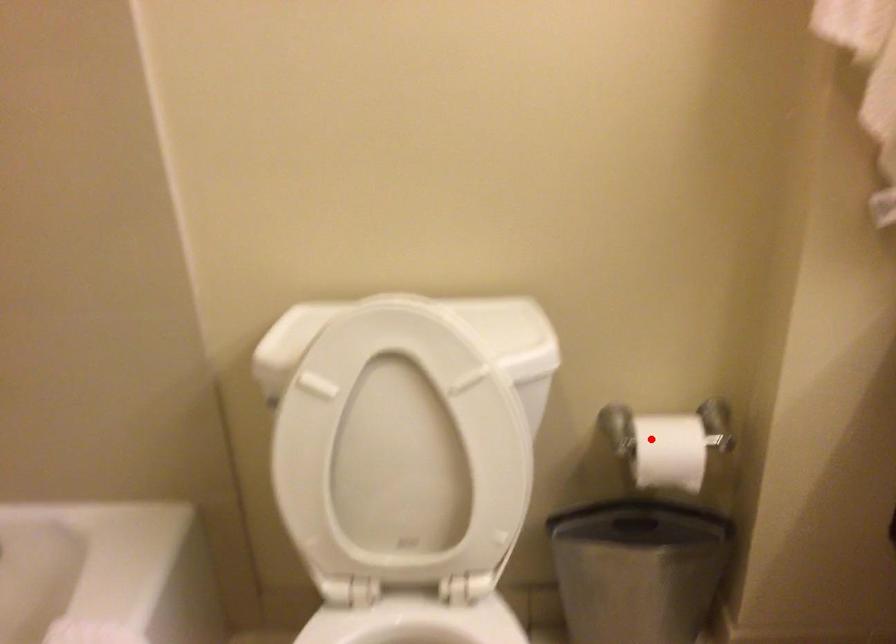
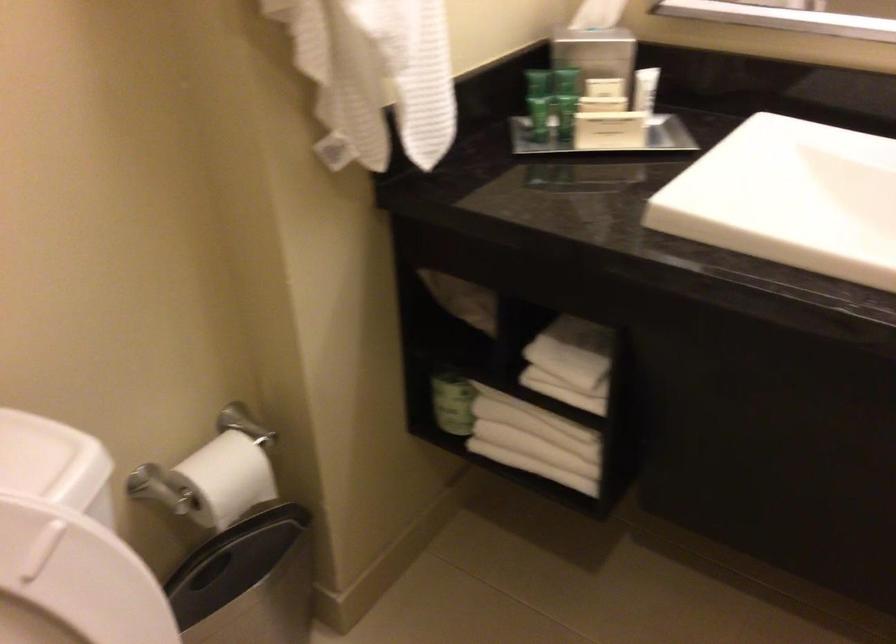
Question: I am providing you with two images of the same scene from different viewpoints. A red point is shown in image1. For the corresponding object point in image2, is it positioned nearer or farther from the camera?

Choices:
 (A) Nearer
 (B) Farther

Answer: (A)